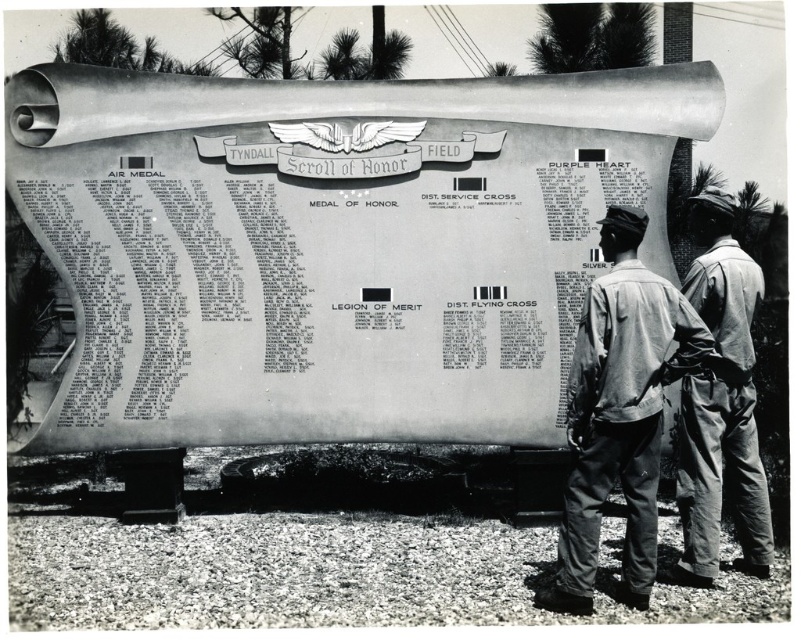
You are an archivist examining the memorial scroll. You notice two points marked on the scroll. The first point is at coordinates point (590, 342) and the second is at point (706, 196). Which point is closer to you when viewing the scroll?

Point (590, 342) is closer to the viewer than point (706, 196).

You are observing a memorial scroll in a museum. You notice a gray fabric jacket at center and a denim pants at lower right. Which object is located lower in the image?

The gray fabric jacket at center is positioned under denim pants at lower right, so the gray fabric jacket at center is located lower in the image.

Please describe the position of the gray fabric jacket at center in terms of its coordinates on the image. The image has a coordinate system where the origin is at the bottom left corner, with x increasing to the right and y increasing upward. The coordinates are normalized between 0 and 1. Use the provided coordinates from the description to answer.

The gray fabric jacket at center is located at the coordinates point (618, 412) on the image.